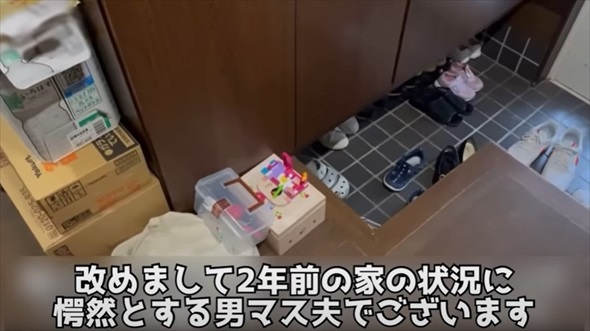
At what (x,y) coordinates should I click in order to perform the action: click on clear plastic box. Please return your answer as a coordinate pair (x, y). Looking at the image, I should click on (247, 225).